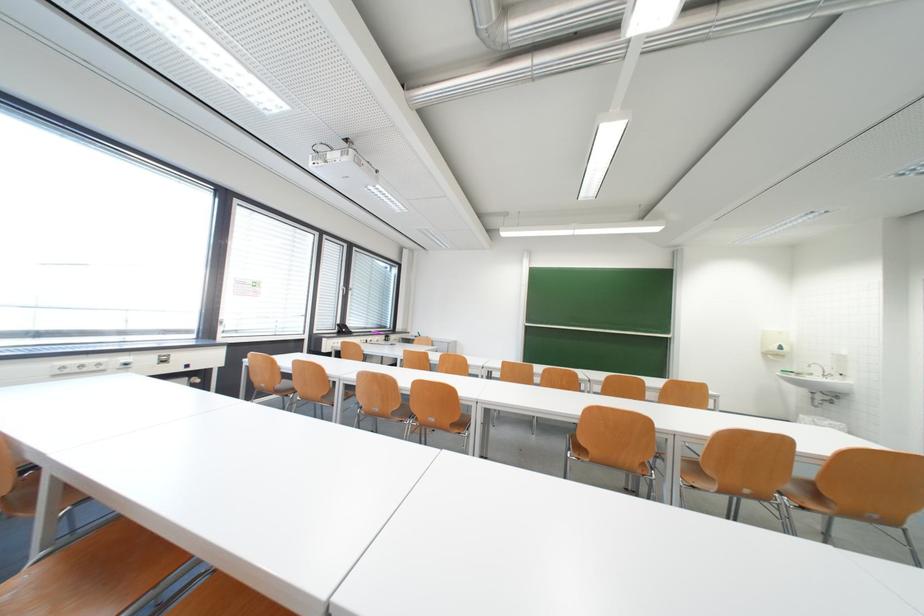
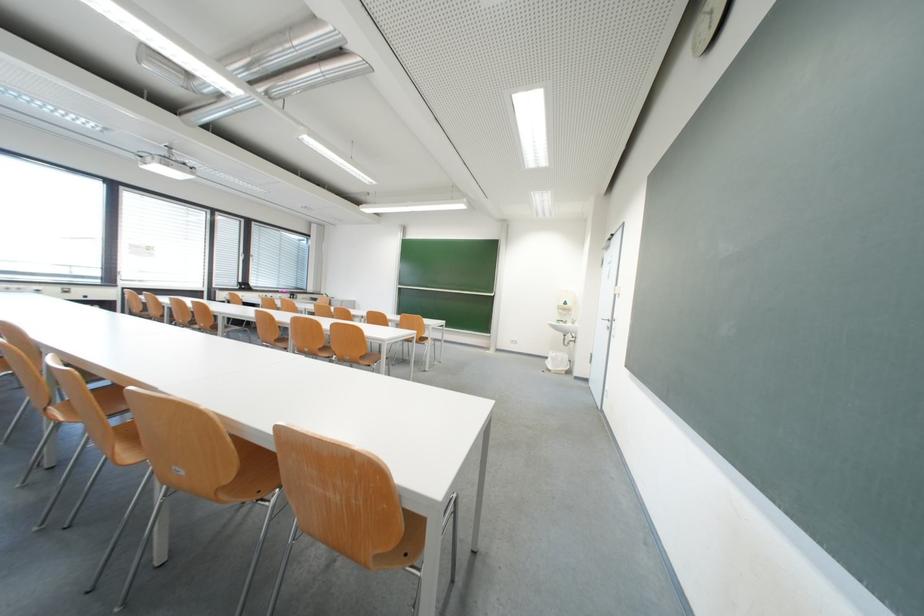
Question: In a continuous first-person perspective shot, in which direction is the camera moving?

Choices:
 (A) Left
 (B) Right
 (C) Forward
 (D) Backward

Answer: (B)